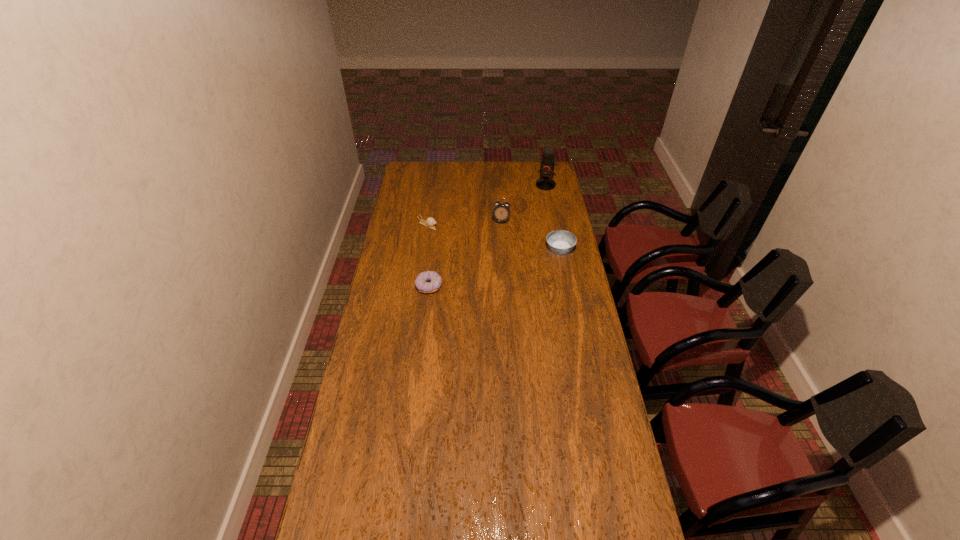
Locate an element on the screen. free area in between the ashtray and the farthest object is located at coordinates (553, 217).

Identify which object is located as the fourth nearest to the third object from left to right. Please provide its 2D coordinates. Your answer should be formatted as a tuple, i.e. [(x, y)], where the tuple contains the x and y coordinates of a point satisfying the conditions above.

[(426, 282)]

Locate which object is the closest to the farthest object. Please provide its 2D coordinates. Your answer should be formatted as a tuple, i.e. [(x, y)], where the tuple contains the x and y coordinates of a point satisfying the conditions above.

[(501, 212)]

Identify the location of free spot that satisfies the following two spatial constraints: 1. on the back side of the escargot; 2. on the left side of the third object from left to right. (428, 221).

I want to click on vacant space that satisfies the following two spatial constraints: 1. on the back side of the doughnut; 2. on the left side of the fourth shortest object, so click(437, 221).

Where is `vacant space that satisfies the following two spatial constraints: 1. on the back side of the microphone; 2. on the right side of the alarm clock`? This screenshot has height=540, width=960. vacant space that satisfies the following two spatial constraints: 1. on the back side of the microphone; 2. on the right side of the alarm clock is located at coordinates (499, 185).

The height and width of the screenshot is (540, 960). In order to click on free space that satisfies the following two spatial constraints: 1. on the front side of the ashtray; 2. on the left side of the fourth shortest object in this screenshot , I will do `click(503, 249)`.

What are the coordinates of `free space that satisfies the following two spatial constraints: 1. on the back side of the second tallest object; 2. on the right side of the tallest object` in the screenshot? It's located at tap(499, 185).